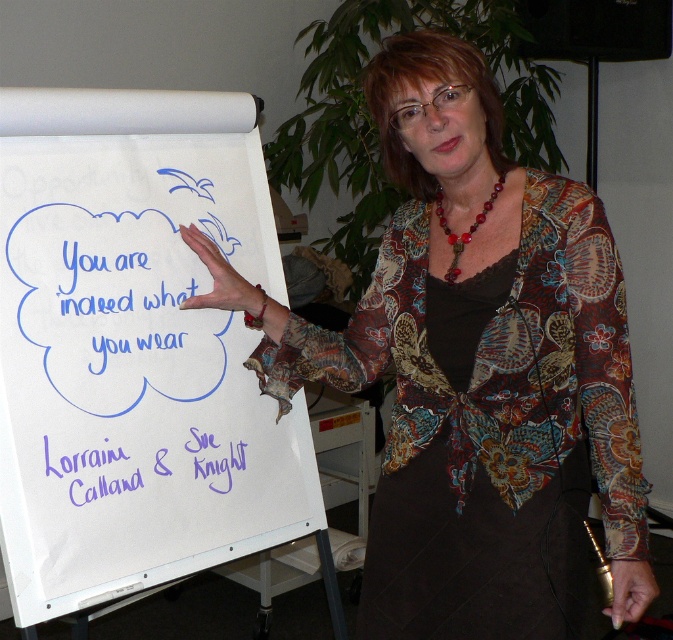
Between white paperboard at center and blue marker text at center, which one has less height?

blue marker text at center is shorter.

Who is positioned more to the left, white paperboard at center or blue marker text at center?

Positioned to the left is blue marker text at center.

Is point (162, 428) more distant than point (85, 252)?

Yes.

Find the location of a particular element. This screenshot has height=640, width=673. white paperboard at center is located at coordinates (135, 371).

Is floral-patterned blouse at center taller than white paperboard at center?

Indeed, floral-patterned blouse at center has a greater height compared to white paperboard at center.

This screenshot has height=640, width=673. In order to click on floral-patterned blouse at center in this screenshot , I will do `click(474, 369)`.

Where is `floral-patterned blouse at center`? The height and width of the screenshot is (640, 673). floral-patterned blouse at center is located at coordinates (474, 369).

Does point (400, 161) lie behind point (182, 358)?

No, (400, 161) is closer to viewer.

Locate an element on the screen. floral-patterned blouse at center is located at coordinates (474, 369).